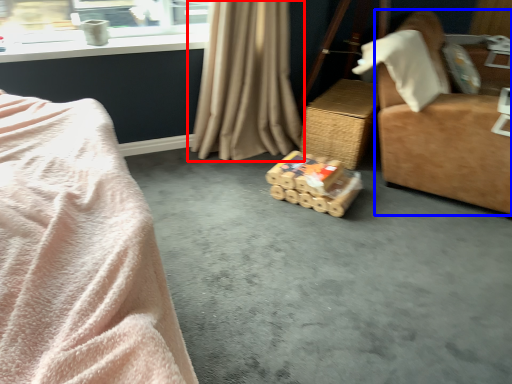
Question: Which of the following is the closest to the observer, curtain (highlighted by a red box) or furniture (highlighted by a blue box)?

Choices:
 (A) curtain
 (B) furniture

Answer: (B)